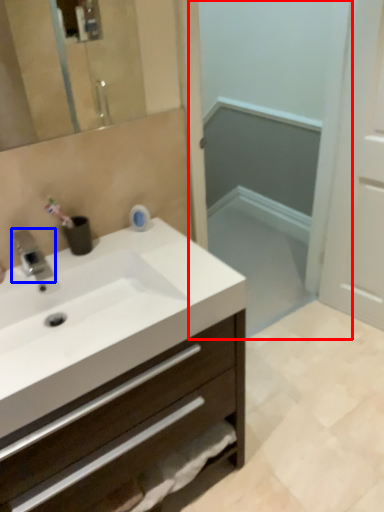
Question: Which object is closer to the camera taking this photo, screen door (highlighted by a red box) or tap (highlighted by a blue box)?

Choices:
 (A) screen door
 (B) tap

Answer: (B)